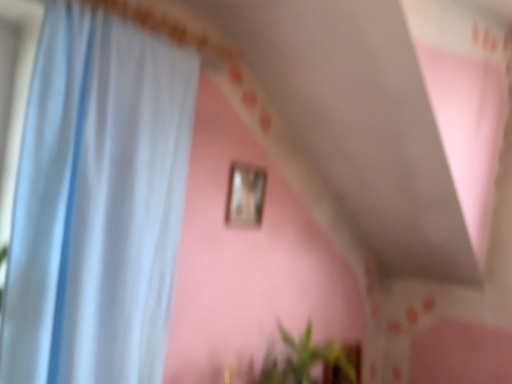
Question: Considering the relative positions of wooden picture frame at upper center and white sheer curtain at left in the image provided, is wooden picture frame at upper center to the left of white sheer curtain at left from the viewer's perspective?

Choices:
 (A) yes
 (B) no

Answer: (B)

Question: Is wooden picture frame at upper center bigger than white sheer curtain at left?

Choices:
 (A) yes
 (B) no

Answer: (B)

Question: Is white sheer curtain at left located within wooden picture frame at upper center?

Choices:
 (A) no
 (B) yes

Answer: (A)

Question: Does wooden picture frame at upper center have a lesser height compared to white sheer curtain at left?

Choices:
 (A) no
 (B) yes

Answer: (B)

Question: Is wooden picture frame at upper center positioned with its back to white sheer curtain at left?

Choices:
 (A) yes
 (B) no

Answer: (B)

Question: Considering their positions, is green leafy plant at lower center located in front of or behind white sheer curtain at left?

Choices:
 (A) behind
 (B) front

Answer: (A)

Question: Is green leafy plant at lower center situated inside white sheer curtain at left or outside?

Choices:
 (A) outside
 (B) inside

Answer: (A)

Question: From the image's perspective, is green leafy plant at lower center positioned above or below white sheer curtain at left?

Choices:
 (A) above
 (B) below

Answer: (B)

Question: From a real-world perspective, is green leafy plant at lower center above or below white sheer curtain at left?

Choices:
 (A) above
 (B) below

Answer: (B)

Question: From their relative heights in the image, would you say white sheer curtain at left is taller or shorter than wooden picture frame at upper center?

Choices:
 (A) short
 (B) tall

Answer: (B)

Question: Based on their positions, is white sheer curtain at left located to the left or right of wooden picture frame at upper center?

Choices:
 (A) right
 (B) left

Answer: (B)

Question: From the image's perspective, relative to wooden picture frame at upper center, is white sheer curtain at left above or below?

Choices:
 (A) above
 (B) below

Answer: (B)

Question: Is white sheer curtain at left wider or thinner than wooden picture frame at upper center?

Choices:
 (A) thin
 (B) wide

Answer: (B)

Question: Based on their positions, is green leafy plant at lower center located to the left or right of wooden picture frame at upper center?

Choices:
 (A) right
 (B) left

Answer: (A)

Question: From a real-world perspective, is green leafy plant at lower center above or below wooden picture frame at upper center?

Choices:
 (A) above
 (B) below

Answer: (B)